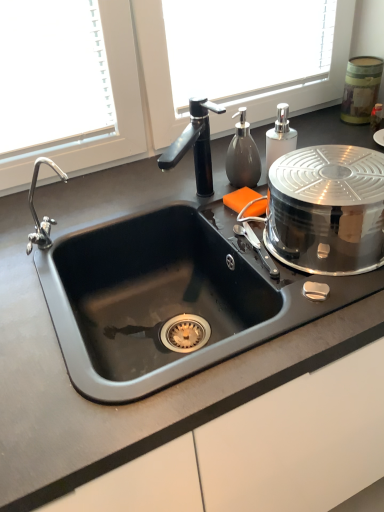
Question: Should I look upward or downward to see metallic canister at upper right, placed as the second appliance when sorted from bottom to top?

Choices:
 (A) down
 (B) up

Answer: (B)

Question: Is white glossy soap dispenser at upper right, arranged as the first soap dispenser when viewed from the right, shorter than metallic canister at upper right, the first appliance positioned from the right?

Choices:
 (A) no
 (B) yes

Answer: (B)

Question: Is white glossy soap dispenser at upper right, positioned as the second soap dispenser in left-to-right order, to the right of metallic canister at upper right, the first appliance positioned from the right, from the viewer's perspective?

Choices:
 (A) yes
 (B) no

Answer: (B)

Question: Is white glossy soap dispenser at upper right, positioned as the second soap dispenser in left-to-right order, turned away from metallic canister at upper right, placed as the 2th appliance when sorted from left to right?

Choices:
 (A) no
 (B) yes

Answer: (A)

Question: Is white glossy soap dispenser at upper right, positioned as the second soap dispenser in left-to-right order, far away from metallic canister at upper right, placed as the 1th appliance when sorted from back to front?

Choices:
 (A) yes
 (B) no

Answer: (B)

Question: From a real-world perspective, is white glossy soap dispenser at upper right, positioned as the second soap dispenser in left-to-right order, on metallic canister at upper right, placed as the 2th appliance when sorted from left to right?

Choices:
 (A) yes
 (B) no

Answer: (A)

Question: Does white glossy soap dispenser at upper right, arranged as the first soap dispenser when viewed from the right, have a lesser width compared to metallic canister at upper right, which is counted as the first appliance, starting from the top?

Choices:
 (A) yes
 (B) no

Answer: (A)

Question: Considering the relative sizes of metallic canister at upper right, the first appliance positioned from the right, and white glossy soap dispenser at upper right, positioned as the second soap dispenser in left-to-right order, in the image provided, is metallic canister at upper right, the first appliance positioned from the right, thinner than white glossy soap dispenser at upper right, positioned as the second soap dispenser in left-to-right order,?

Choices:
 (A) yes
 (B) no

Answer: (B)

Question: Does metallic canister at upper right, placed as the 1th appliance when sorted from back to front, come behind white glossy soap dispenser at upper right, positioned as the second soap dispenser in left-to-right order?

Choices:
 (A) yes
 (B) no

Answer: (A)

Question: Could white glossy soap dispenser at upper right, arranged as the first soap dispenser when viewed from the right, be considered to be inside metallic canister at upper right, the first appliance positioned from the right?

Choices:
 (A) yes
 (B) no

Answer: (B)

Question: Is metallic canister at upper right, which is counted as the first appliance, starting from the top, to the left of white glossy soap dispenser at upper right, positioned as the second soap dispenser in left-to-right order, from the viewer's perspective?

Choices:
 (A) yes
 (B) no

Answer: (B)

Question: Does metallic canister at upper right, the first appliance positioned from the right, lie in front of white glossy soap dispenser at upper right, positioned as the second soap dispenser in left-to-right order?

Choices:
 (A) yes
 (B) no

Answer: (B)

Question: Can you confirm if metallic canister at upper right, placed as the 1th appliance when sorted from back to front, is positioned to the right of white glossy soap dispenser at upper right, arranged as the first soap dispenser when viewed from the right?

Choices:
 (A) yes
 (B) no

Answer: (A)

Question: Does polished stainless steel lid at right, which is the first appliance in bottom-to-top order, appear on the right side of metallic canister at upper right, placed as the second appliance when sorted from bottom to top?

Choices:
 (A) no
 (B) yes

Answer: (A)